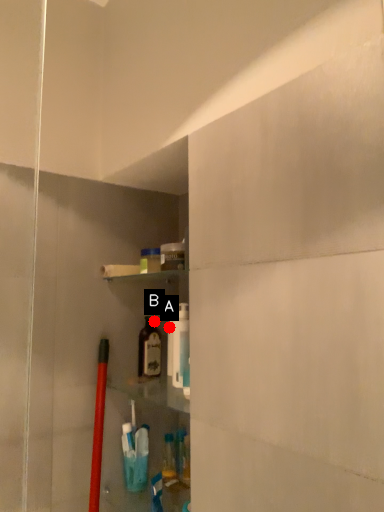
Question: Two points are circled on the image, labeled by A and B beside each circle. Which point is farther to the camera?

Choices:
 (A) A is further
 (B) B is further

Answer: (B)